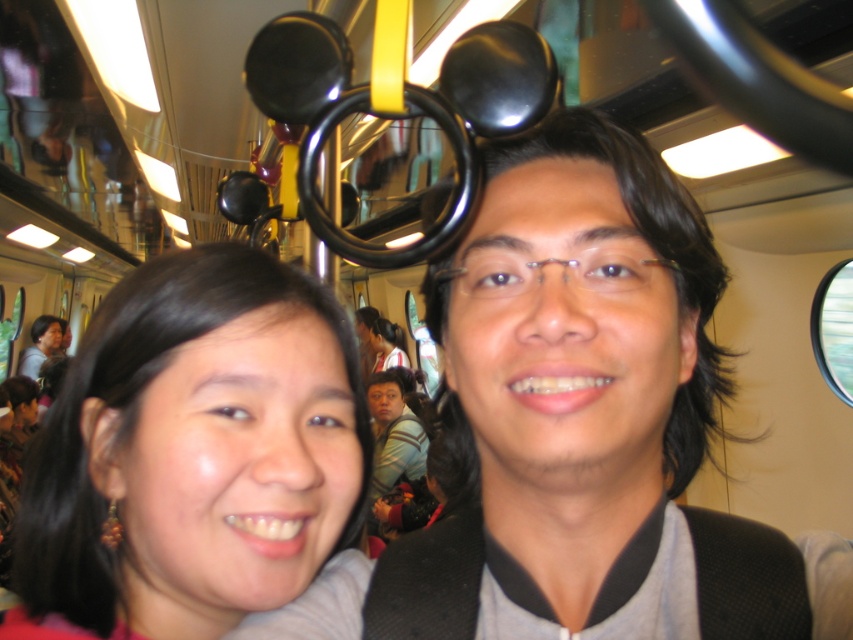
You are on a train and need to place a small black backpack on the seat between the two people. The seat is represented by the black fabric at center. Where exactly should you place the backpack to ensure it doesn not fall off the seat? Use the coordinates provided in the Objects Description to determine the safest spot.

The safest spot to place the backpack on the seat is at the coordinates provided in the Objects Description, specifically at point (563,388), which is the center of the black fabric at center. This central position ensures stability and prevents the backpack from sliding off.

You are a passenger on a train and see the black fabric at center and the black hair at center. Which object is located to the right when facing the front of the train?

The black fabric at center is to the right of the black hair at center.

You are a passenger on a train and want to know if you can safely place a small backpack between the two points marked as point (x=602, y=164). The backpack requires at least 16 inches of space. Can you fit it there?

The two points marked as point (x=602, y=164) are 18.16 inches apart, which is more than the required 16 inches. Therefore, the backpack can fit safely between them.